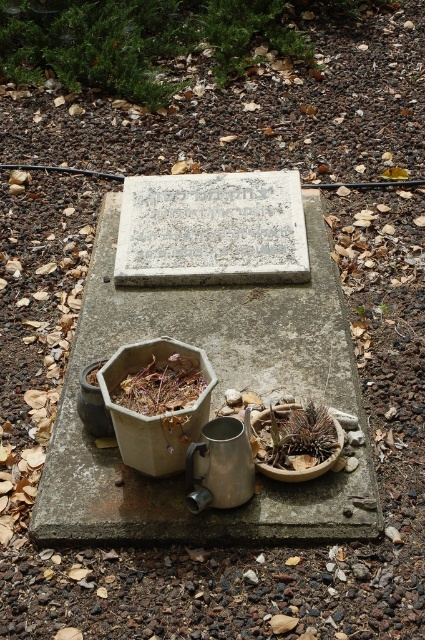
Question: Does gray concrete at center have a greater width compared to green succulent at center?

Choices:
 (A) yes
 (B) no

Answer: (A)

Question: Observing the image, what is the correct spatial positioning of gray concrete at center in reference to green succulent at center?

Choices:
 (A) left
 (B) right

Answer: (A)

Question: Among these objects, which one is farthest from the camera?

Choices:
 (A) gray concrete at center
 (B) green succulent at center

Answer: (B)

Question: Which point appears farthest from the camera in this image?

Choices:
 (A) click(x=320, y=451)
 (B) click(x=277, y=396)

Answer: (B)

Question: Does gray concrete at center have a greater width compared to green succulent at center?

Choices:
 (A) yes
 (B) no

Answer: (A)

Question: Which object appears farthest from the camera in this image?

Choices:
 (A) gray concrete at center
 (B) green succulent at center

Answer: (B)